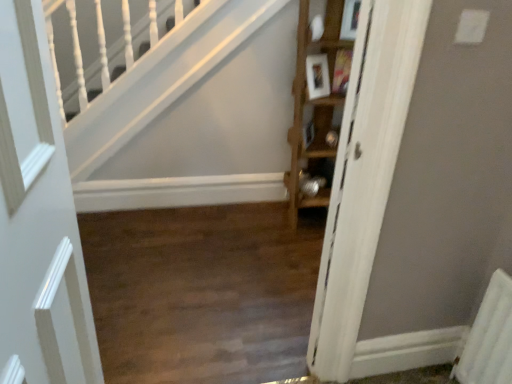
At what (x,y) coordinates should I click in order to perform the action: click on free spot above wooden floor at center (from a real-world perspective). Please return your answer as a coordinate pair (x, y). The width and height of the screenshot is (512, 384). Looking at the image, I should click on (214, 276).